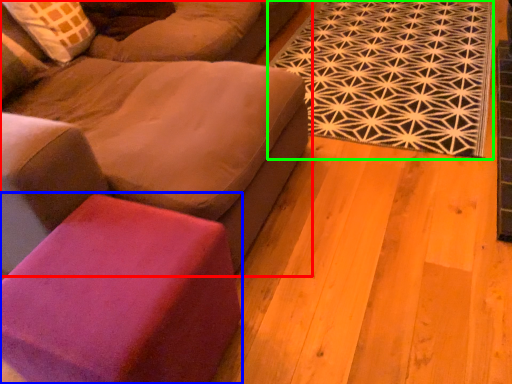
Question: Based on their relative distances, which object is nearer to studio couch (highlighted by a red box)? Choose from stool (highlighted by a blue box) and mat (highlighted by a green box).

Choices:
 (A) stool
 (B) mat

Answer: (A)